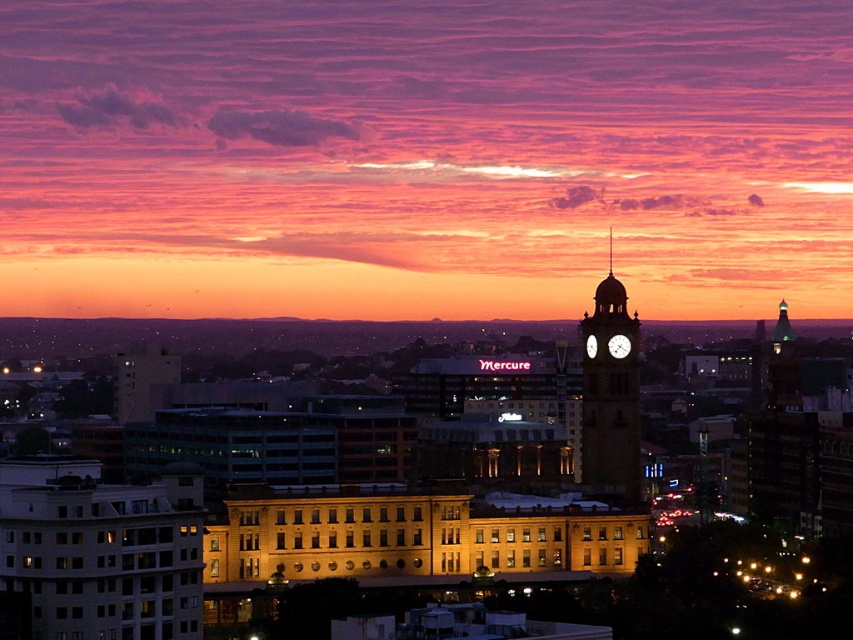
You are a drone operator trying to capture a photo of the white glossy clock tower at center. The camera is currently positioned at point A, which is at coordinates 0.5, 0.5. To ensure the clock tower is centered in the frame, should you move the camera north or south? Please provide your answer based on the coordinates provided.

The white glossy clock tower at center is located at coordinates (610, 396). Since the camera is at (426, 320), which is to the northwest of the clock tower, you should move the camera southeast to center it. Specifically, moving south along the y axis and east along the x axis would align the camera with the tower.